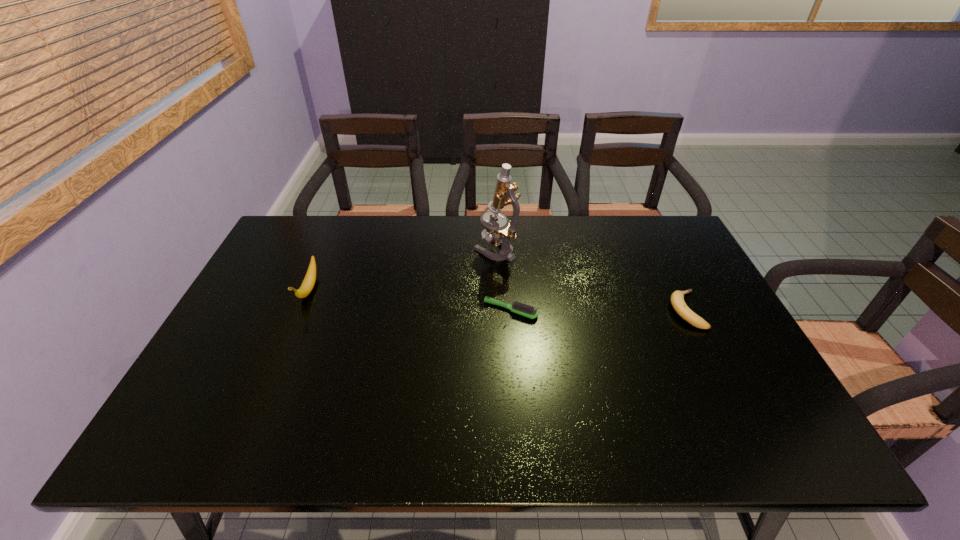
Identify which object is located as the second nearest to the tallest object. Please provide its 2D coordinates. Your answer should be formatted as a tuple, i.e. [(x, y)], where the tuple contains the x and y coordinates of a point satisfying the conditions above.

[(677, 298)]

This screenshot has height=540, width=960. Identify the location of object that stands as the third closest to the left banana. (677, 298).

This screenshot has height=540, width=960. Identify the location of vacant space that satisfies the following two spatial constraints: 1. at the stem of the taller banana; 2. on the left side of the right banana. (300, 310).

The height and width of the screenshot is (540, 960). Identify the location of vacant space that satisfies the following two spatial constraints: 1. at the stem of the third shortest object; 2. on the right side of the hairbrush. (300, 310).

Locate an element on the screen. This screenshot has height=540, width=960. vacant area that satisfies the following two spatial constraints: 1. at the stem of the second shortest object; 2. on the right side of the leftmost object is located at coordinates (300, 310).

Locate an element on the screen. The image size is (960, 540). free point that satisfies the following two spatial constraints: 1. on the front side of the rightmost object; 2. on the left side of the farthest object is located at coordinates (498, 310).

Find the location of `free spot that satisfies the following two spatial constraints: 1. at the stem of the taller banana; 2. on the right side of the shortest object`. free spot that satisfies the following two spatial constraints: 1. at the stem of the taller banana; 2. on the right side of the shortest object is located at coordinates (300, 310).

The width and height of the screenshot is (960, 540). I want to click on free point that satisfies the following two spatial constraints: 1. at the stem of the leftmost object; 2. on the left side of the second shortest object, so click(300, 310).

You are a GUI agent. You are given a task and a screenshot of the screen. Output one action in this format:
    pyautogui.click(x=<x>, y=<y>)
    Task: Click on the vacant space that satisfies the following two spatial constraints: 1. on the front side of the rightmost object; 2. on the left side of the microscope
    
    Given the screenshot: What is the action you would take?
    pyautogui.click(x=498, y=310)

Locate an element on the screen. vacant region that satisfies the following two spatial constraints: 1. on the front side of the rightmost object; 2. on the left side of the farthest object is located at coordinates (498, 310).